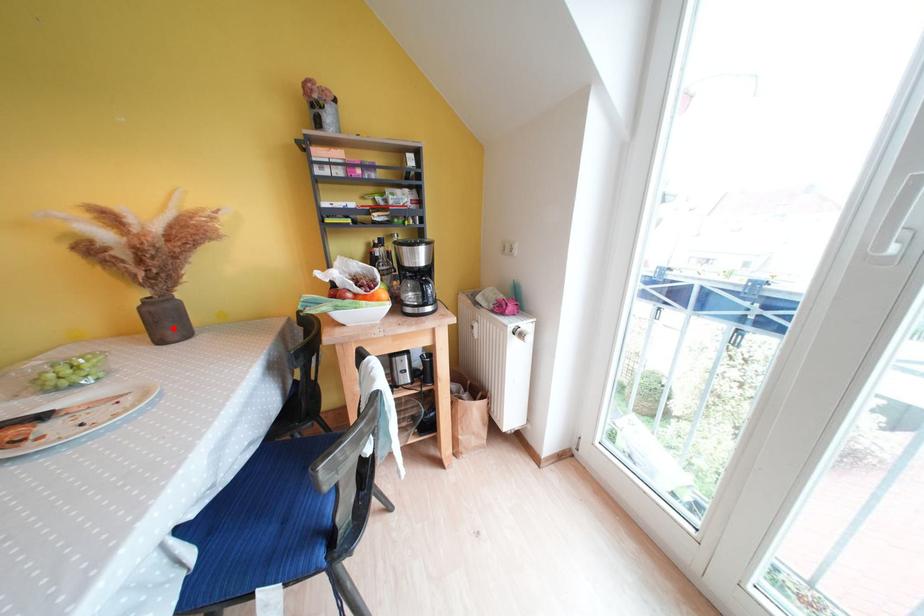
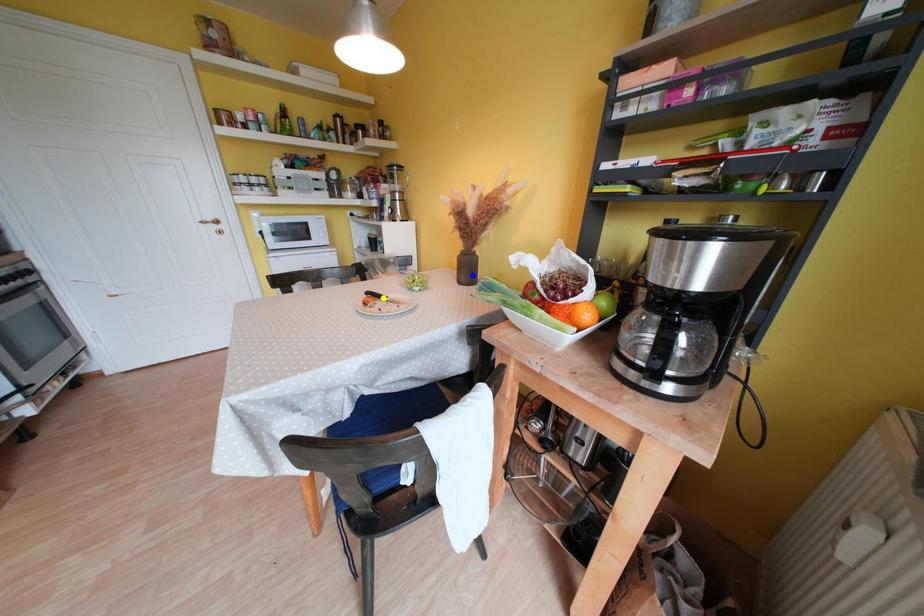
Question: I am providing you with two images of the same scene from different viewpoints. A red point is marked on the first image. You are given multiple points on the second image. Can you choose the point in image 2 that corresponds to the point in image 1?

Choices:
 (A) yellow point
 (B) green point
 (C) blue point

Answer: (C)